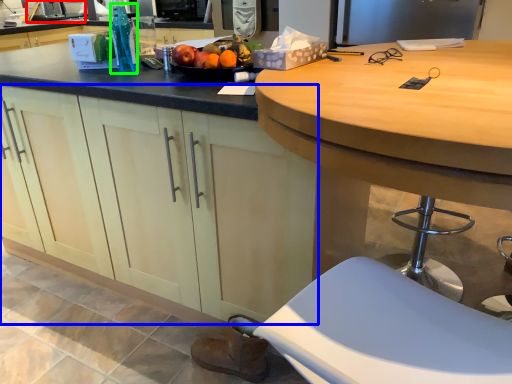
Question: Which object is positioned closest to sink (highlighted by a red box)? Select from cabinetry (highlighted by a blue box) and bottle (highlighted by a green box).

Choices:
 (A) cabinetry
 (B) bottle

Answer: (B)